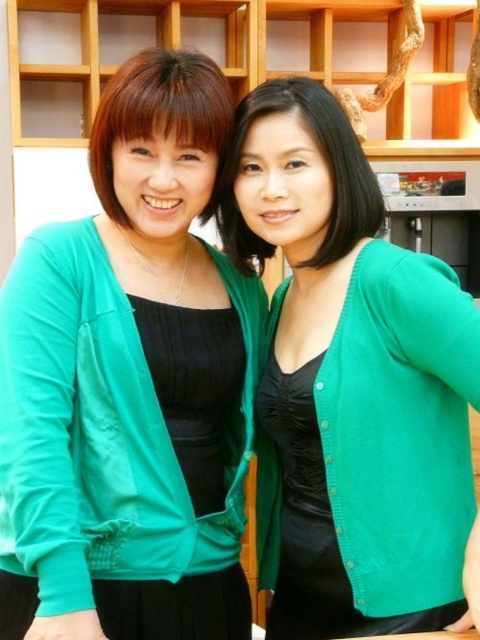
Question: Does matte green cardigan at left have a smaller size compared to matte black blouse at left?

Choices:
 (A) no
 (B) yes

Answer: (A)

Question: From the image, what is the correct spatial relationship of smooth black blouse at center in relation to matte black blouse at left?

Choices:
 (A) left
 (B) right

Answer: (B)

Question: Among these objects, which one is nearest to the camera?

Choices:
 (A) green matte cardigan at center
 (B) matte green cardigan at left
 (C) matte black blouse at left

Answer: (B)

Question: Is green matte cardigan at center to the right of smooth black blouse at center from the viewer's perspective?

Choices:
 (A) no
 (B) yes

Answer: (B)

Question: Which of these objects is positioned closest to the matte green cardigan at left?

Choices:
 (A) matte black blouse at left
 (B) smooth black blouse at center
 (C) green matte cardigan at center

Answer: (A)

Question: Among these points, which one is nearest to the camera?

Choices:
 (A) (228, 140)
 (B) (349, 278)

Answer: (B)